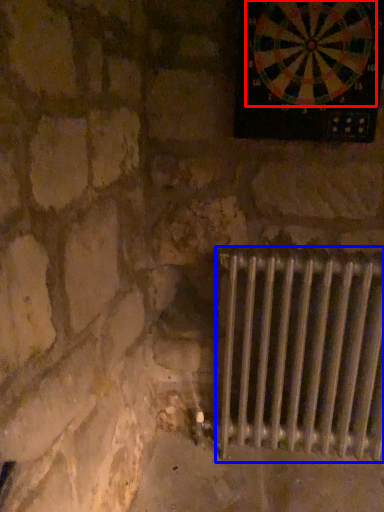
Question: Which object is further to the camera taking this photo, wheel (highlighted by a red box) or radiator (highlighted by a blue box)?

Choices:
 (A) wheel
 (B) radiator

Answer: (B)